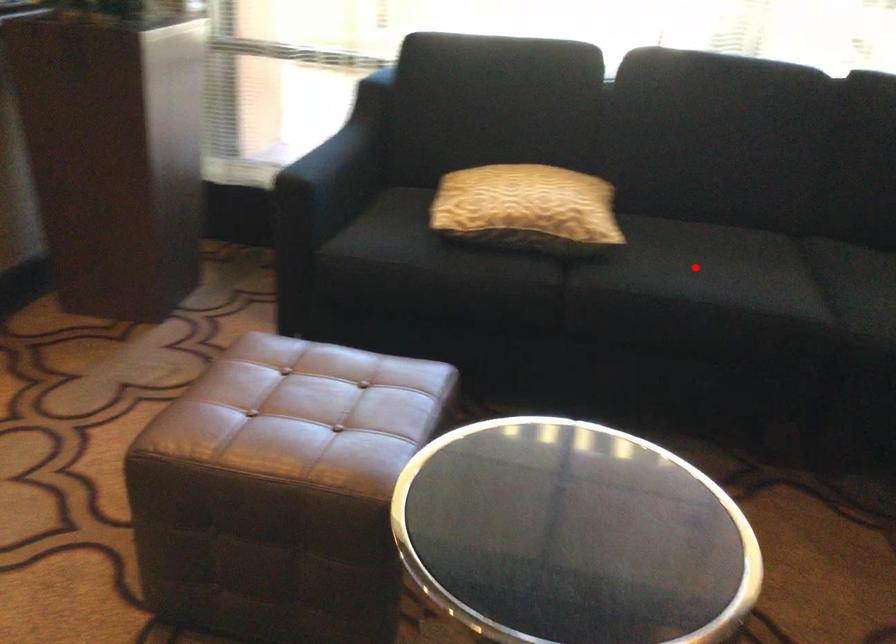
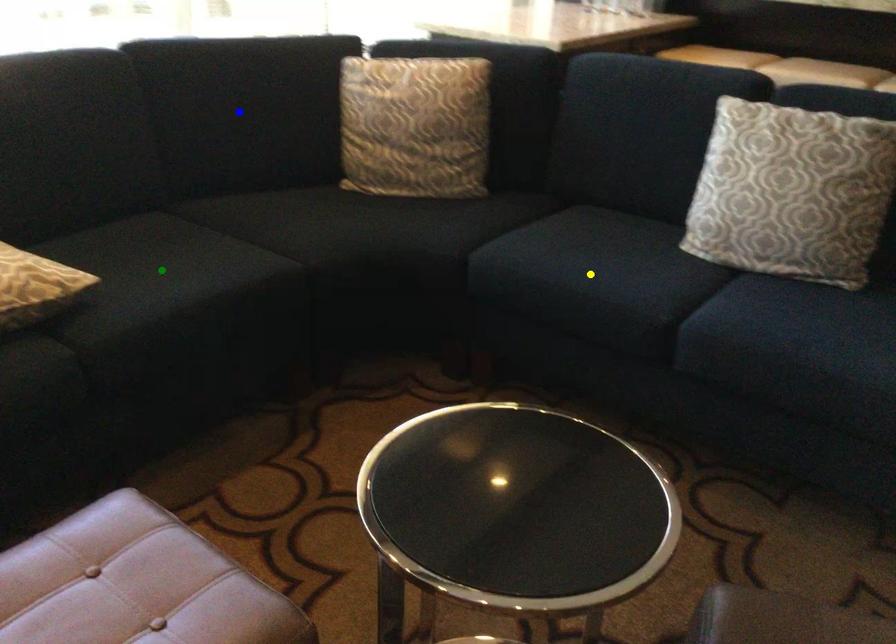
Question: I am providing you with two images of the same scene from different viewpoints. A red point is marked on the first image. You are given multiple points on the second image. Which point in image 2 represents the same 3d spot as the red point in image 1?

Choices:
 (A) green point
 (B) yellow point
 (C) blue point

Answer: (A)